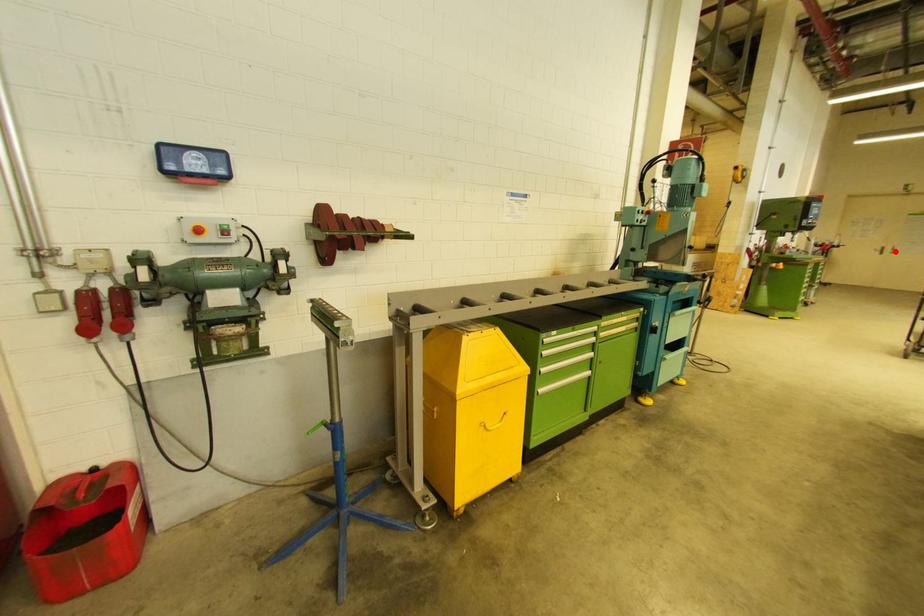
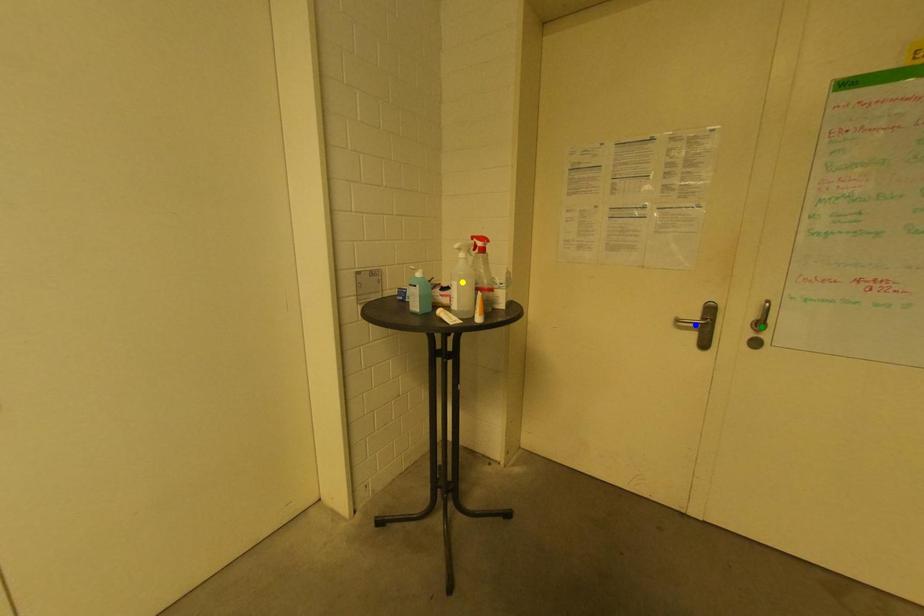
Question: I am providing you with two images of the same scene from different viewpoints. A red point is marked on the first image. You are given multiple points on the second image. Can you choose the point in image 2 that corresponds to the point in image 1?

Choices:
 (A) blue point
 (B) green point
 (C) yellow point

Answer: (B)